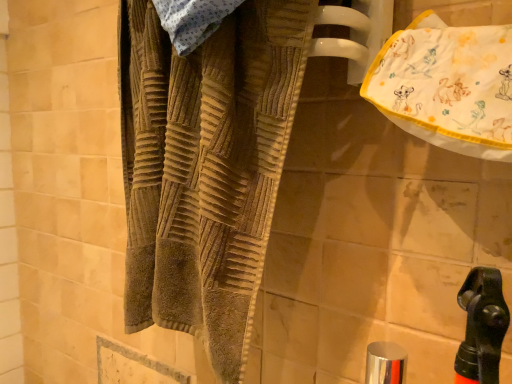
Question: Is brown textured towel at center wider than white cotton towel at upper right?

Choices:
 (A) yes
 (B) no

Answer: (A)

Question: Can you confirm if brown textured towel at center is shorter than white cotton towel at upper right?

Choices:
 (A) no
 (B) yes

Answer: (A)

Question: Can you see brown textured towel at center touching white cotton towel at upper right?

Choices:
 (A) no
 (B) yes

Answer: (A)

Question: Is brown textured towel at center facing away from white cotton towel at upper right?

Choices:
 (A) yes
 (B) no

Answer: (B)

Question: From the image's perspective, is brown textured towel at center below white cotton towel at upper right?

Choices:
 (A) yes
 (B) no

Answer: (A)

Question: Considering the positions of silver metallic faucet at lower center and brown textured towel at center in the image, is silver metallic faucet at lower center bigger or smaller than brown textured towel at center?

Choices:
 (A) big
 (B) small

Answer: (B)

Question: Visually, is silver metallic faucet at lower center positioned to the left or to the right of brown textured towel at center?

Choices:
 (A) left
 (B) right

Answer: (B)

Question: Is silver metallic faucet at lower center in front of or behind brown textured towel at center in the image?

Choices:
 (A) behind
 (B) front

Answer: (A)

Question: Considering the positions of point (386, 344) and point (230, 82), is point (386, 344) closer or farther from the camera than point (230, 82)?

Choices:
 (A) farther
 (B) closer

Answer: (A)

Question: From the image's perspective, is silver metallic faucet at lower center positioned above or below white cotton towel at upper right?

Choices:
 (A) above
 (B) below

Answer: (B)

Question: In the image, is silver metallic faucet at lower center on the left side or the right side of white cotton towel at upper right?

Choices:
 (A) right
 (B) left

Answer: (B)

Question: Which is correct: silver metallic faucet at lower center is inside white cotton towel at upper right, or outside of it?

Choices:
 (A) inside
 (B) outside

Answer: (B)

Question: Relative to white cotton towel at upper right, is silver metallic faucet at lower center in front or behind?

Choices:
 (A) behind
 (B) front

Answer: (A)

Question: Considering the positions of white cotton towel at upper right and silver metallic faucet at lower center in the image, is white cotton towel at upper right wider or thinner than silver metallic faucet at lower center?

Choices:
 (A) thin
 (B) wide

Answer: (B)

Question: Considering the positions of point (457, 61) and point (373, 354), is point (457, 61) closer or farther from the camera than point (373, 354)?

Choices:
 (A) farther
 (B) closer

Answer: (B)